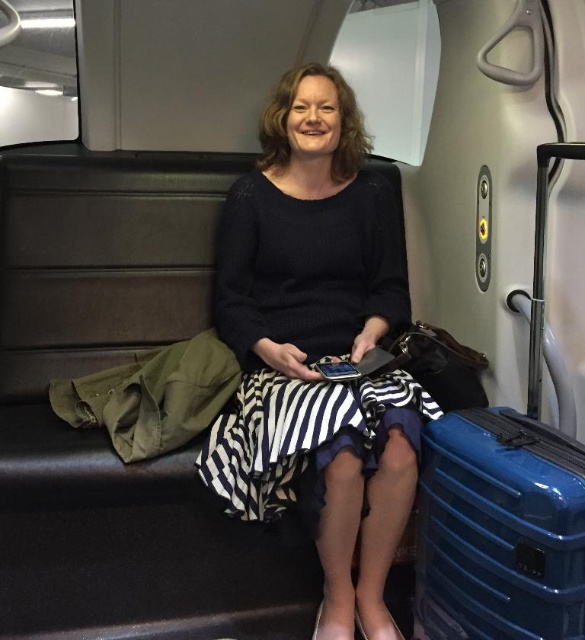
In the scene shown: You are a passenger in the train car and want to know where the black striped dress at center is located. Can you describe its position relative to other objects in the scene?

The black striped dress at center is located at point coordinates of (x=301, y=332). However, since the scene description does not provide specific coordinates for other objects, I cannot compare its position relative to other objects in the scene.

You are a delivery robot that needs to place a 15 inch package between the black striped dress at center and the blue hardshell suitcase at lower right. Can you fit the package between them without moving either item?

The black striped dress at center and the blue hardshell suitcase at lower right are 15.25 inches apart from each other. Since the package is 15 inches long, it can fit between them as there is enough space.